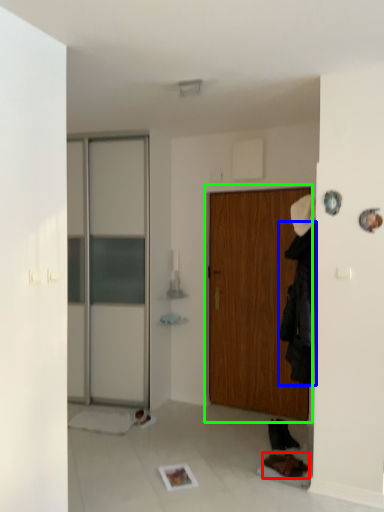
Question: Estimate the real-world distances between objects in this image. Which object is closer to shoe (highlighted by a red box), clothing (highlighted by a blue box) or door (highlighted by a green box)?

Choices:
 (A) clothing
 (B) door

Answer: (A)